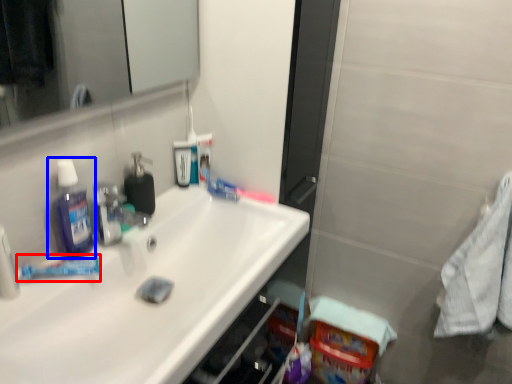
Question: Among these objects, which one is farthest to the camera, toothpaste (highlighted by a red box) or mouthwash (highlighted by a blue box)?

Choices:
 (A) toothpaste
 (B) mouthwash

Answer: (A)